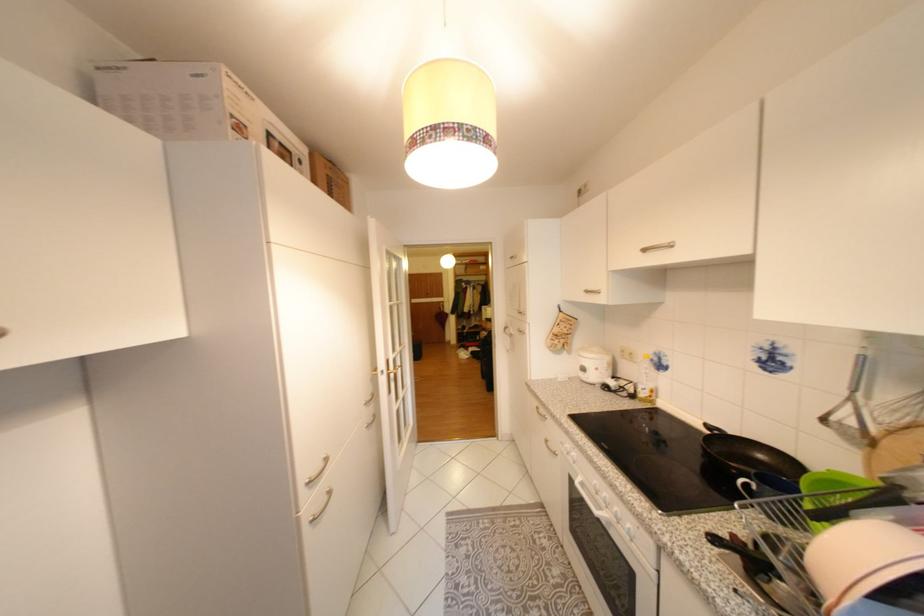
I want to click on curved drawer handle, so click(x=317, y=471).